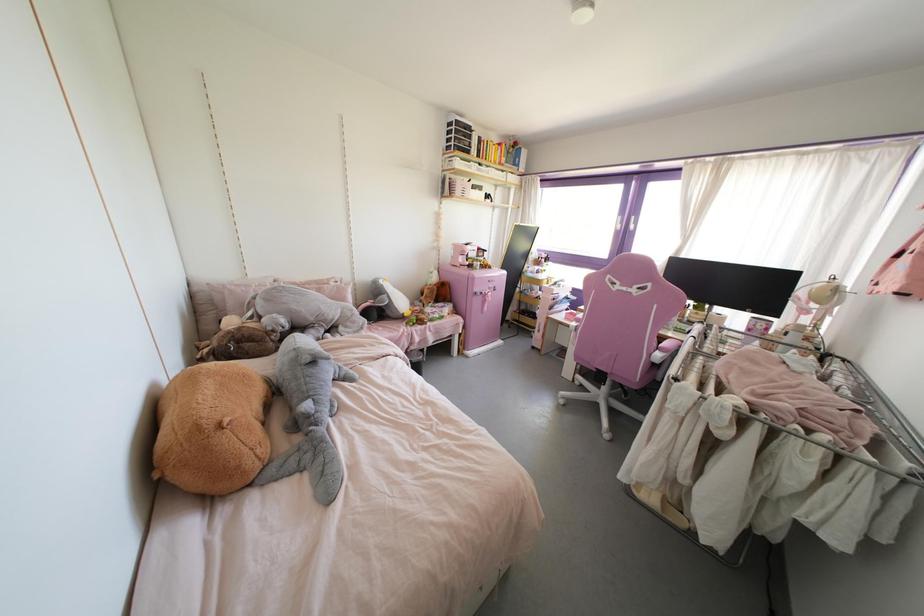
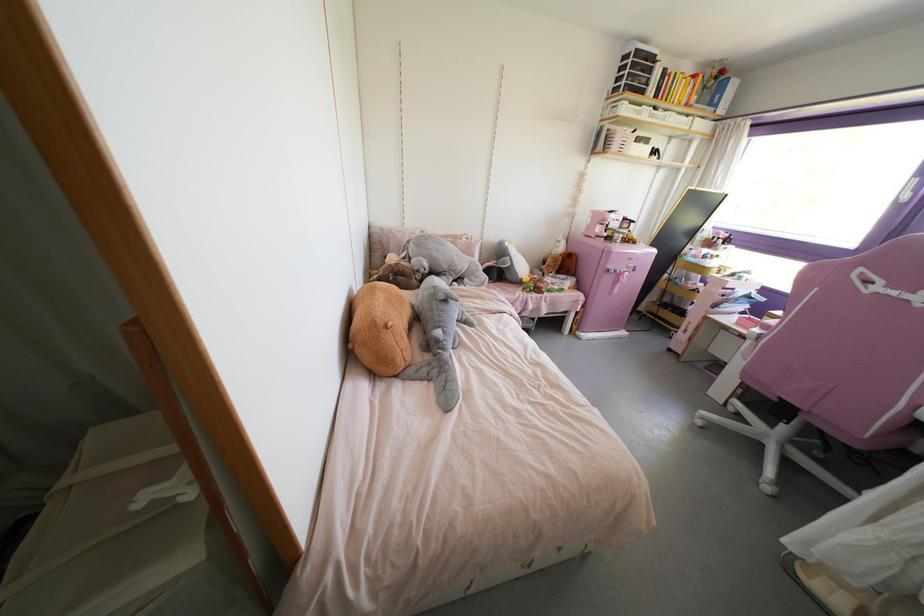
In the second image, find the point that corresponds to point 578,320 in the first image.

(764, 326)